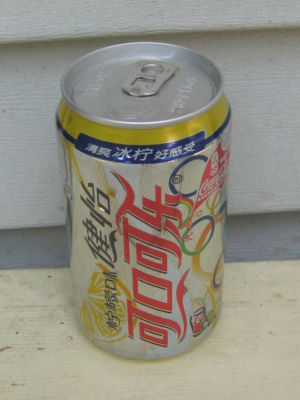
Where is `drinking glass`? drinking glass is located at coordinates (198, 326).